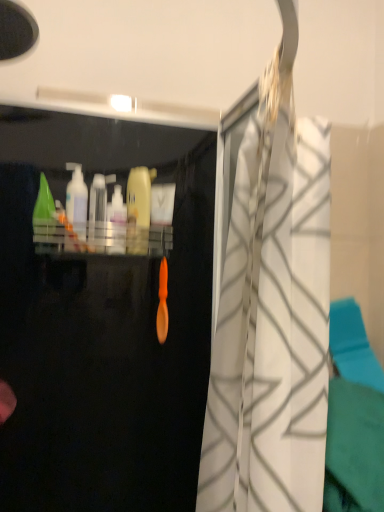
Question: Does translucent plastic bottle at left, positioned as the 3th cleaning product in right-to-left order, have a greater height compared to green plastic cone at upper left, which ranks as the first cleaning product in left-to-right order?

Choices:
 (A) yes
 (B) no

Answer: (A)

Question: Is translucent plastic bottle at left, positioned as the 3th cleaning product in right-to-left order, looking in the opposite direction of green plastic cone at upper left, which is counted as the fourth cleaning product, starting from the right?

Choices:
 (A) no
 (B) yes

Answer: (A)

Question: Considering the relative sizes of translucent plastic bottle at left, positioned as the 3th cleaning product in right-to-left order, and green plastic cone at upper left, which is counted as the fourth cleaning product, starting from the right, in the image provided, is translucent plastic bottle at left, positioned as the 3th cleaning product in right-to-left order, thinner than green plastic cone at upper left, which is counted as the fourth cleaning product, starting from the right,?

Choices:
 (A) no
 (B) yes

Answer: (A)

Question: From the image's perspective, does translucent plastic bottle at left, positioned as the 3th cleaning product in right-to-left order, appear lower than green plastic cone at upper left, which ranks as the first cleaning product in left-to-right order?

Choices:
 (A) no
 (B) yes

Answer: (A)

Question: From a real-world perspective, is translucent plastic bottle at left, positioned as the 3th cleaning product in right-to-left order, located higher than green plastic cone at upper left, which ranks as the first cleaning product in left-to-right order?

Choices:
 (A) yes
 (B) no

Answer: (A)

Question: Considering the relative sizes of translucent plastic bottle at left, which ranks as the 2th cleaning product in left-to-right order, and green plastic cone at upper left, which ranks as the first cleaning product in left-to-right order, in the image provided, is translucent plastic bottle at left, which ranks as the 2th cleaning product in left-to-right order, wider than green plastic cone at upper left, which ranks as the first cleaning product in left-to-right order,?

Choices:
 (A) no
 (B) yes

Answer: (A)

Question: Is yellow matte bottle at center, which is the first cleaning product in right-to-left order, closer to camera compared to green plastic cone at upper left, which ranks as the first cleaning product in left-to-right order?

Choices:
 (A) no
 (B) yes

Answer: (A)

Question: From a real-world perspective, is yellow matte bottle at center, which is the first cleaning product in right-to-left order, beneath green plastic cone at upper left, which ranks as the first cleaning product in left-to-right order?

Choices:
 (A) no
 (B) yes

Answer: (A)

Question: From a real-world perspective, is yellow matte bottle at center, which is the first cleaning product in right-to-left order, over green plastic cone at upper left, which is counted as the fourth cleaning product, starting from the right?

Choices:
 (A) yes
 (B) no

Answer: (A)

Question: Does yellow matte bottle at center, which is the first cleaning product in right-to-left order, turn towards green plastic cone at upper left, which ranks as the first cleaning product in left-to-right order?

Choices:
 (A) no
 (B) yes

Answer: (A)

Question: Considering the relative positions of yellow matte bottle at center, which is the first cleaning product in right-to-left order, and green plastic cone at upper left, which is counted as the fourth cleaning product, starting from the right, in the image provided, is yellow matte bottle at center, which is the first cleaning product in right-to-left order, to the left of green plastic cone at upper left, which is counted as the fourth cleaning product, starting from the right, from the viewer's perspective?

Choices:
 (A) no
 (B) yes

Answer: (A)

Question: Is yellow matte bottle at center, which is the first cleaning product in right-to-left order, further to the viewer compared to green plastic cone at upper left, which ranks as the first cleaning product in left-to-right order?

Choices:
 (A) yes
 (B) no

Answer: (A)

Question: Is green plastic cone at upper left, which ranks as the first cleaning product in left-to-right order, oriented away from transparent plastic bottle at center?

Choices:
 (A) yes
 (B) no

Answer: (B)